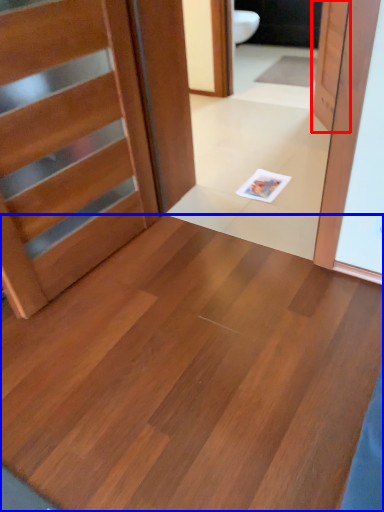
Question: Among these objects, which one is nearest to the camera, door (highlighted by a red box) or plywood (highlighted by a blue box)?

Choices:
 (A) door
 (B) plywood

Answer: (B)